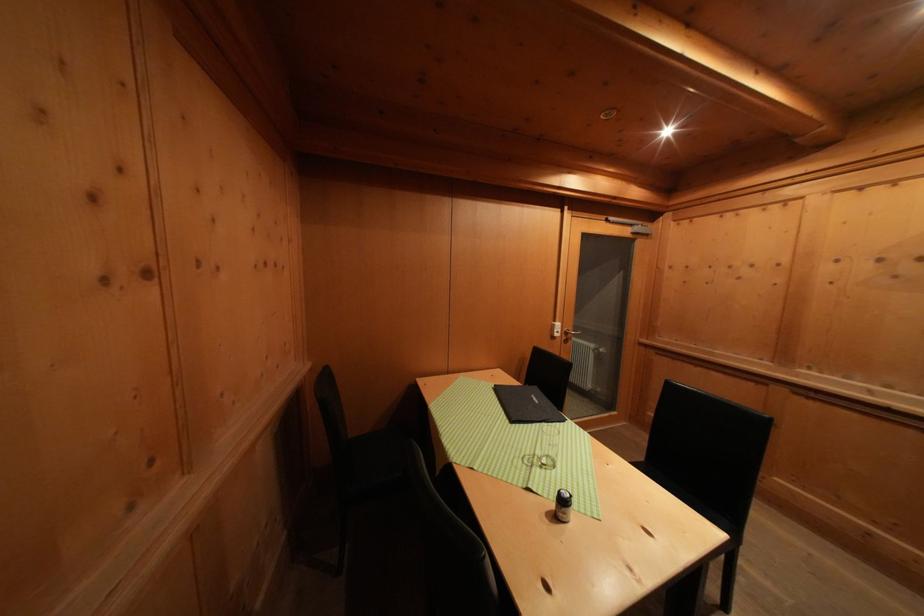
Image resolution: width=924 pixels, height=616 pixels. I want to click on small black shaker, so [x=563, y=506].